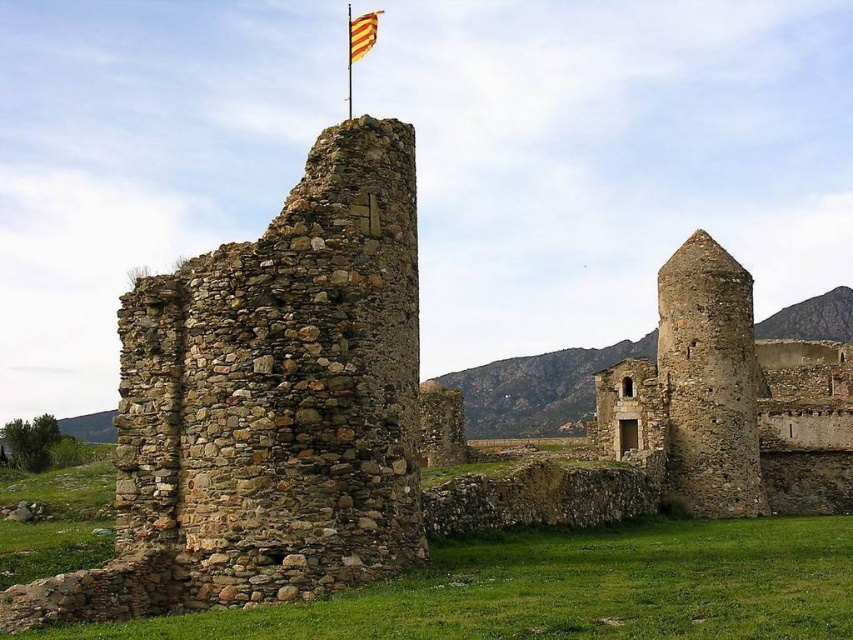
Question: Observing the image, what is the correct spatial positioning of stone tower at right in reference to yellow striped fabric at top?

Choices:
 (A) left
 (B) right

Answer: (B)

Question: Is stone tower at right positioned at the back of yellow striped fabric at top?

Choices:
 (A) no
 (B) yes

Answer: (B)

Question: Considering the relative positions of stone tower at right and yellow striped fabric at top in the image provided, where is stone tower at right located with respect to yellow striped fabric at top?

Choices:
 (A) right
 (B) left

Answer: (A)

Question: Among these points, which one is farthest from the camera?

Choices:
 (A) (351, 24)
 (B) (625, 376)

Answer: (A)